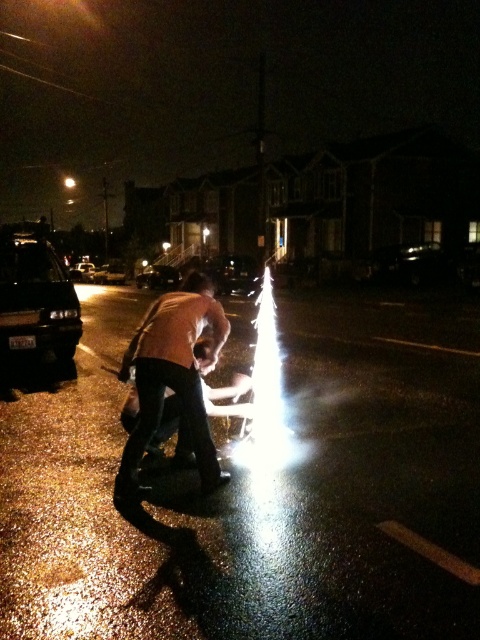
You are a photographer trying to capture the reflection of the light brown leather jacket at center and the shiny silver car at center on the wet pavement. Which object will have a more prominent reflection?

The light brown leather jacket at center is in front of the shiny silver car at center, so its reflection will be closer to the photographer and therefore more prominent.

You are a photographer trying to capture the reflection of the two points on the wet pavement. Which point, point (43, 241) or point (149, 282), will appear closer to the camera in your photo?

Point (43, 241) is closer to the camera than point (149, 282), so it will appear closer in the photo.